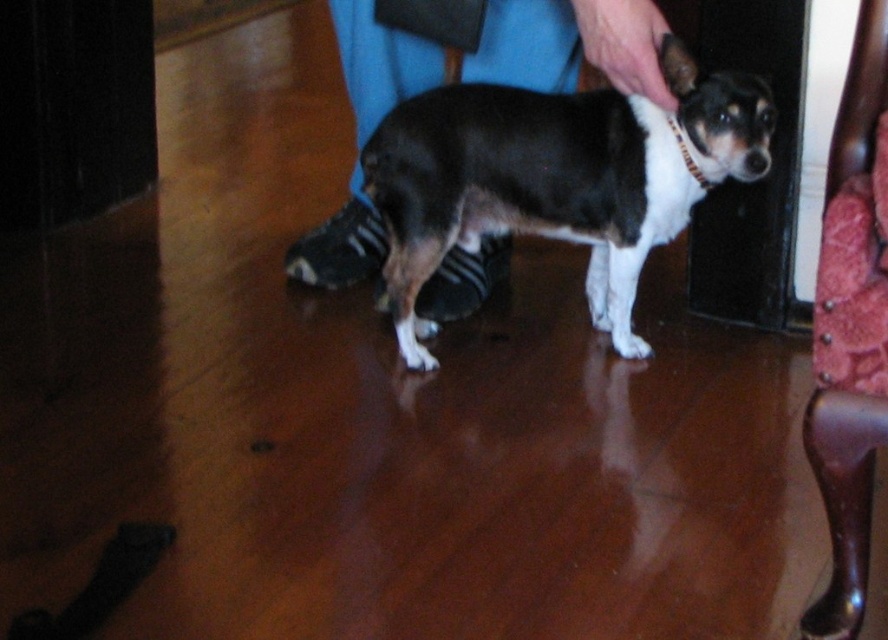
Can you confirm if black smooth dog at center is wider than velvet red armchair at right?

Correct, the width of black smooth dog at center exceeds that of velvet red armchair at right.

Is black smooth dog at center below velvet red armchair at right?

Actually, black smooth dog at center is above velvet red armchair at right.

Locate an element on the screen. The width and height of the screenshot is (888, 640). black smooth dog at center is located at coordinates (557, 179).

Image resolution: width=888 pixels, height=640 pixels. I want to click on black smooth dog at center, so click(557, 179).